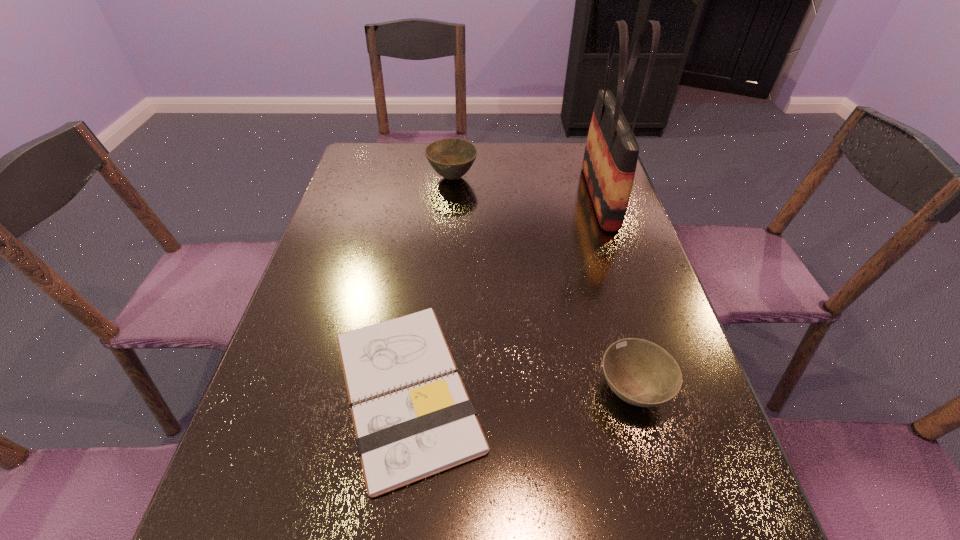
Identify the location of vacant space at the right edge of the desktop. This screenshot has height=540, width=960. (700, 446).

Find the location of `free space at the far left corner of the desktop`. free space at the far left corner of the desktop is located at coordinates point(379,164).

What are the coordinates of `vacant region between the second tallest object and the third tallest object` in the screenshot? It's located at click(542, 284).

Identify the location of free space between the notepad and the second tallest object. The width and height of the screenshot is (960, 540). (429, 284).

At what (x,y) coordinates should I click in order to perform the action: click on unoccupied area between the nearer bowl and the taller bowl. Please return your answer as a coordinate pair (x, y). This screenshot has width=960, height=540. Looking at the image, I should click on click(x=542, y=284).

Identify the location of free space between the tallest object and the left bowl. (526, 187).

Find the location of `vacant space that is in between the nearer bowl and the farther bowl`. vacant space that is in between the nearer bowl and the farther bowl is located at coordinates (542, 284).

This screenshot has height=540, width=960. What are the coordinates of `empty space between the shopping bag and the shortest object` in the screenshot? It's located at (503, 293).

Identify the location of vacant region between the taller bowl and the second shortest object. This screenshot has width=960, height=540. coord(542,284).

You are a GUI agent. You are given a task and a screenshot of the screen. Output one action in this format:
    pyautogui.click(x=<x>, y=<y>)
    Task: Click on the free spot between the shopping bag and the shortest object
    The width and height of the screenshot is (960, 540).
    Given the screenshot: What is the action you would take?
    pyautogui.click(x=503, y=293)